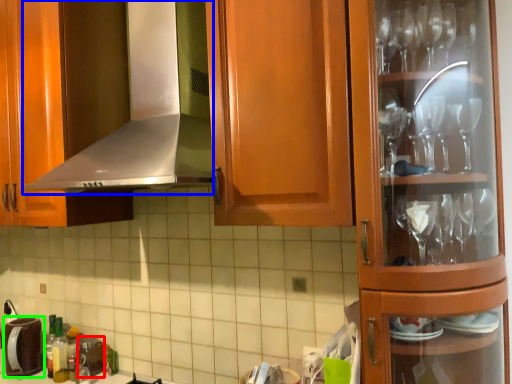
Question: Which object is positioned farthest from appliance (highlighted by a red box)? Select from exhaust hood (highlighted by a blue box) and appliance (highlighted by a green box).

Choices:
 (A) exhaust hood
 (B) appliance

Answer: (A)